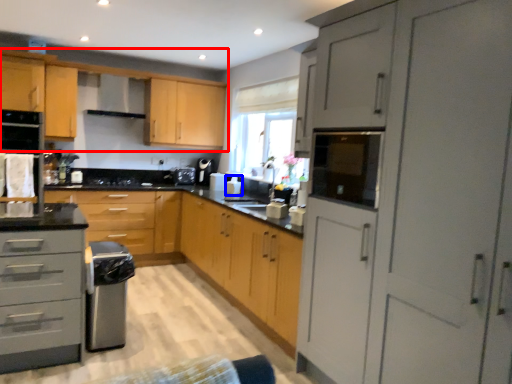
Question: Among these objects, which one is farthest to the camera, cabinetry (highlighted by a red box) or appliance (highlighted by a blue box)?

Choices:
 (A) cabinetry
 (B) appliance

Answer: (B)